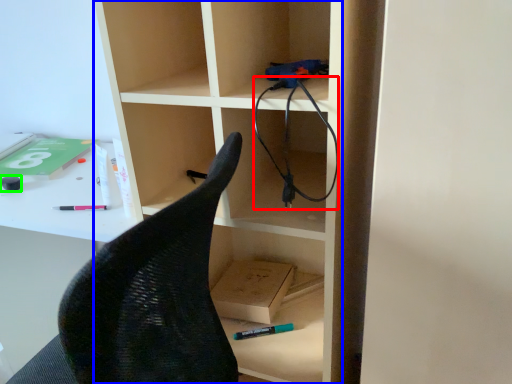
Question: Which object is the closest to the cable (highlighted by a red box)? Choose among these: bookshelf (highlighted by a blue box) or stationery (highlighted by a green box).

Choices:
 (A) bookshelf
 (B) stationery

Answer: (A)